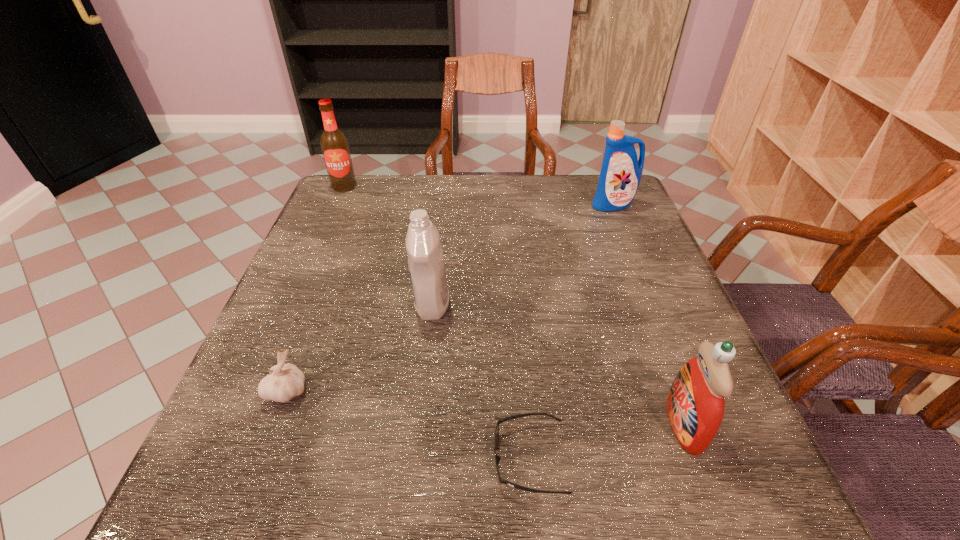
Identify the location of vacant space at the right edge of the desktop. (590, 241).

The image size is (960, 540). Identify the location of free location at the near left corner of the desktop. (217, 477).

Image resolution: width=960 pixels, height=540 pixels. I want to click on vacant position at the far right corner of the desktop, so click(595, 181).

I want to click on free space between the farthest detergent and the sunglasses, so click(571, 332).

You are a GUI agent. You are given a task and a screenshot of the screen. Output one action in this format:
    pyautogui.click(x=<x>, y=<y>)
    Task: Click on the empty space that is in between the shortest object and the nearest detergent
    The image size is (960, 540).
    Given the screenshot: What is the action you would take?
    pyautogui.click(x=607, y=441)

What are the coordinates of `free area in between the second shortest object and the nearest detergent` in the screenshot? It's located at (486, 408).

Image resolution: width=960 pixels, height=540 pixels. I want to click on free space between the nearest detergent and the beer bottle, so click(x=514, y=306).

Where is `empty location between the farthest object and the nearest detergent`? The height and width of the screenshot is (540, 960). empty location between the farthest object and the nearest detergent is located at coordinates (514, 306).

This screenshot has height=540, width=960. Identify the location of blank region between the garlic and the farthest detergent. (450, 298).

Find the location of a particular element. Image resolution: width=960 pixels, height=540 pixels. empty space between the third object from right to left and the garlic is located at coordinates (409, 424).